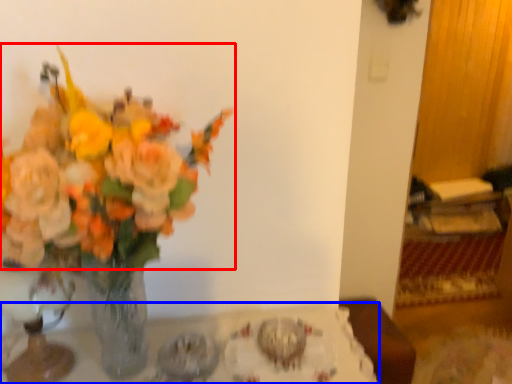
Question: Which of the following is the closest to the observer, flower (highlighted by a red box) or table (highlighted by a blue box)?

Choices:
 (A) flower
 (B) table

Answer: (A)